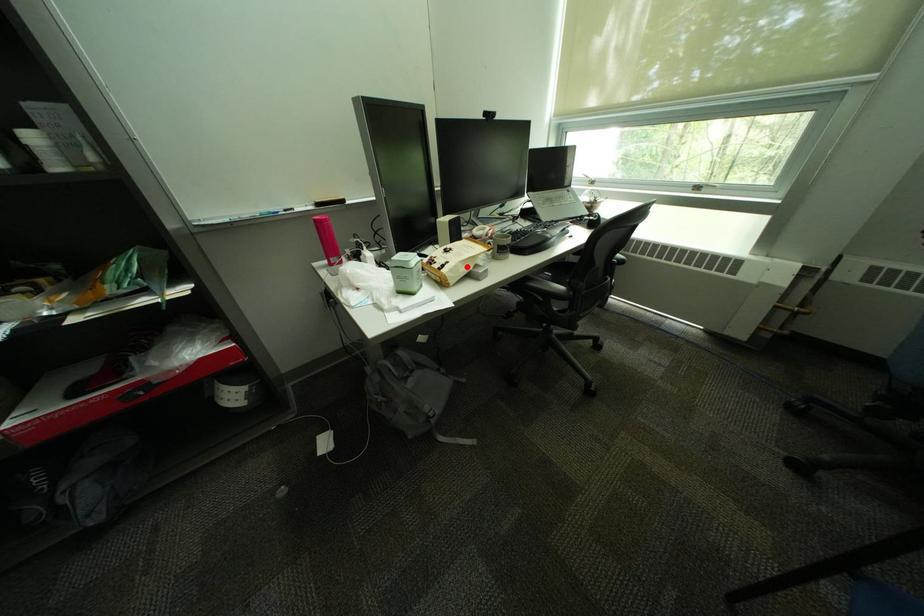
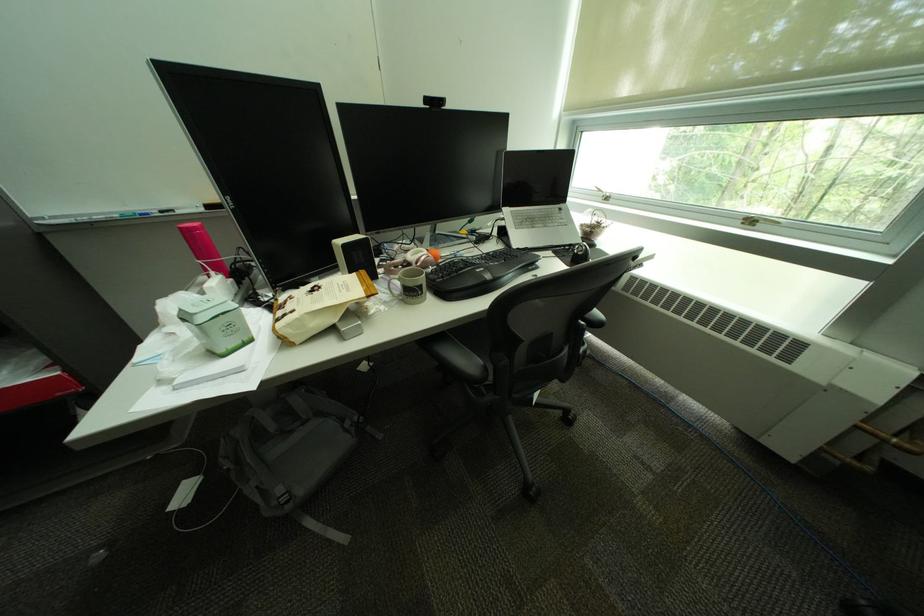
Locate, in the second image, the point that corresponds to the highlighted location in the first image.

(309, 321)